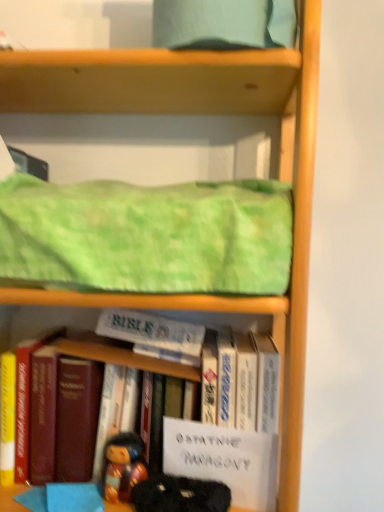
Question: Would you say hardcover book at center, the first book in the left-to-right sequence, contains white paper at center, which is counted as the 1th paperback book, starting from the bottom?

Choices:
 (A) yes
 (B) no

Answer: (B)

Question: Is hardcover book at center, the first book in the left-to-right sequence, positioned with its back to white paper at center, which is counted as the 2th paperback book, starting from the back?

Choices:
 (A) no
 (B) yes

Answer: (A)

Question: Is hardcover book at center, which ranks as the 2th book in right-to-left order, far from white paper at center, which is counted as the 2th paperback book, starting from the back?

Choices:
 (A) no
 (B) yes

Answer: (A)

Question: Is hardcover book at center, which ranks as the 2th book in right-to-left order, oriented towards white paper at center, the first paperback book in the front-to-back sequence?

Choices:
 (A) no
 (B) yes

Answer: (A)

Question: From a real-world perspective, does hardcover book at center, which ranks as the 2th book in right-to-left order, sit lower than white paper at center, which is counted as the 2th paperback book, starting from the back?

Choices:
 (A) yes
 (B) no

Answer: (B)

Question: Is hardcover book at center, the first book in the left-to-right sequence, inside or outside of velvet-like black doll at lower center?

Choices:
 (A) outside
 (B) inside

Answer: (A)

Question: From the image's perspective, relative to velvet-like black doll at lower center, is hardcover book at center, the first book in the left-to-right sequence, above or below?

Choices:
 (A) above
 (B) below

Answer: (A)

Question: In terms of size, does hardcover book at center, the first book in the left-to-right sequence, appear bigger or smaller than velvet-like black doll at lower center?

Choices:
 (A) small
 (B) big

Answer: (B)

Question: Does point (215, 318) appear closer or farther from the camera than point (211, 485)?

Choices:
 (A) closer
 (B) farther

Answer: (B)

Question: Considering their positions, is hardcover book at center, which is counted as the 1th book, starting from the right, located in front of or behind white paper at center, the 2th paperback book positioned from the top?

Choices:
 (A) behind
 (B) front

Answer: (A)

Question: Visually, is hardcover book at center, marked as the second book in a left-to-right arrangement, positioned to the left or to the right of white paper at center, which is counted as the 1th paperback book, starting from the bottom?

Choices:
 (A) left
 (B) right

Answer: (B)

Question: Looking at the image, does hardcover book at center, marked as the second book in a left-to-right arrangement, seem bigger or smaller compared to white paper at center, the 2th paperback book positioned from the top?

Choices:
 (A) small
 (B) big

Answer: (B)

Question: Which is correct: hardcover book at center, marked as the second book in a left-to-right arrangement, is inside white paper at center, which is counted as the 2th paperback book, starting from the back, or outside of it?

Choices:
 (A) inside
 (B) outside

Answer: (B)

Question: From their relative heights in the image, would you say green textured fabric at upper center is taller or shorter than velvet-like black doll at lower center?

Choices:
 (A) tall
 (B) short

Answer: (A)

Question: Considering the positions of green textured fabric at upper center and velvet-like black doll at lower center in the image, is green textured fabric at upper center bigger or smaller than velvet-like black doll at lower center?

Choices:
 (A) big
 (B) small

Answer: (A)